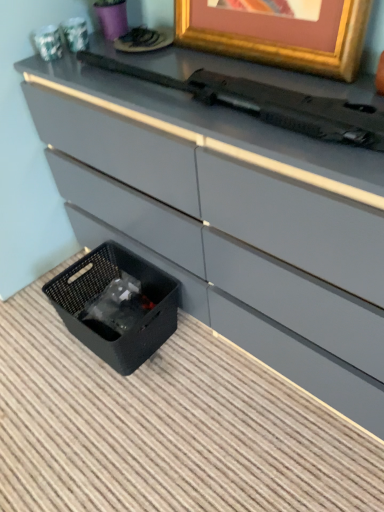
Locate an element on the screen. The image size is (384, 512). vacant space in front of black woven basket at lower left is located at coordinates (117, 407).